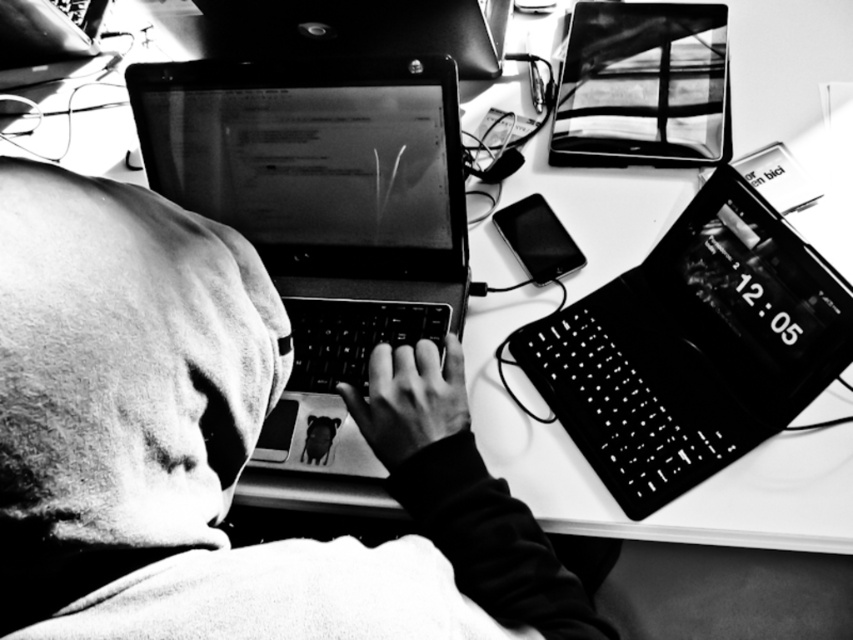
Question: Is matte black laptop at right bigger than glossy plastic laptop at upper center?

Choices:
 (A) yes
 (B) no

Answer: (B)

Question: Among these objects, which one is farthest from the camera?

Choices:
 (A) glossy plastic laptop at upper center
 (B) matte black laptop at right
 (C) matte black laptop at center
 (D) smooth fabric hoodie at center

Answer: (A)

Question: Can you confirm if smooth fabric hoodie at center is positioned to the right of glossy plastic laptop at upper center?

Choices:
 (A) no
 (B) yes

Answer: (A)

Question: Considering the real-world distances, which object is farthest from the matte black laptop at right?

Choices:
 (A) smooth fabric hoodie at center
 (B) glossy plastic laptop at upper center
 (C) matte black laptop at center

Answer: (B)

Question: Can you confirm if smooth fabric hoodie at center is bigger than matte black laptop at right?

Choices:
 (A) yes
 (B) no

Answer: (A)

Question: Which object appears closest to the camera in this image?

Choices:
 (A) smooth fabric hoodie at center
 (B) matte black laptop at center
 (C) matte black laptop at right

Answer: (A)